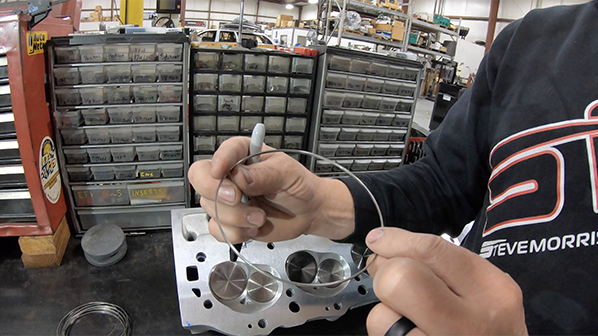
At what (x,y) coordinates should I click in order to perform the action: click on ceiling light. Please return your answer as a coordinate pair (x, y). Looking at the image, I should click on (291, 7).